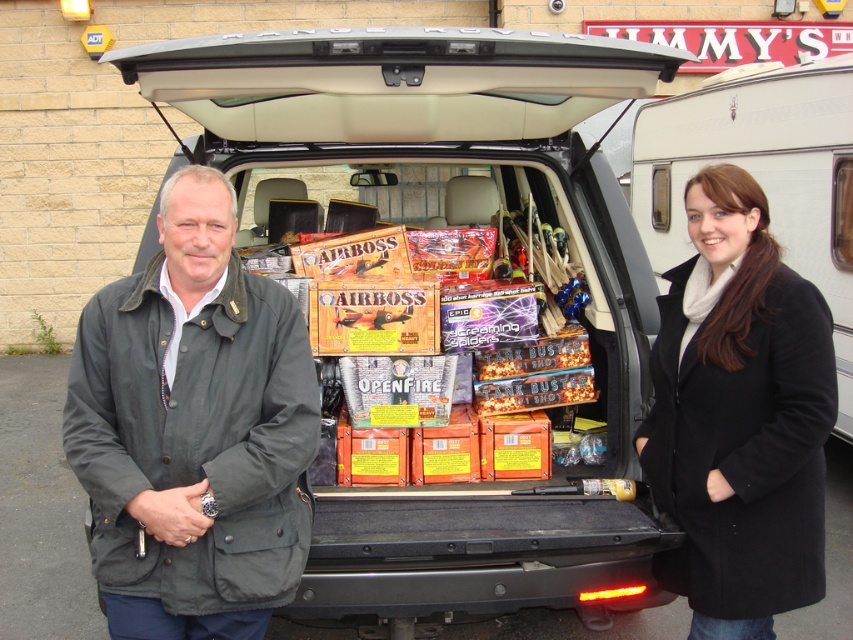
Describe the element at coordinates (193, 429) in the screenshot. I see `dark green waxed fabric jacket at left` at that location.

Who is more distant from viewer, (286, 454) or (706, 92)?

The point (706, 92) is more distant.

Locate an element on the screen. The height and width of the screenshot is (640, 853). dark green waxed fabric jacket at left is located at coordinates (193, 429).

Between point (479, 609) and point (830, 346), which one is positioned in front?

Positioned in front is point (830, 346).

Between point (436, 65) and point (784, 344), which one is positioned behind?

Positioned behind is point (436, 65).

Find the location of a particular element. This screenshot has height=640, width=853. matte black van at center is located at coordinates (457, 228).

You are a GUI agent. You are given a task and a screenshot of the screen. Output one action in this format:
    pyautogui.click(x=<x>, y=<y>)
    Task: Click on the matte black van at center
    The height and width of the screenshot is (640, 853).
    Given the screenshot: What is the action you would take?
    pyautogui.click(x=457, y=228)

Which of these two, black wool coat at lower right or white glossy caravan at upper right, stands taller?

With more height is white glossy caravan at upper right.

Which is in front, point (664, 579) or point (724, 92)?

Positioned in front is point (664, 579).

Identify the location of black wool coat at lower right. This screenshot has width=853, height=640. (740, 417).